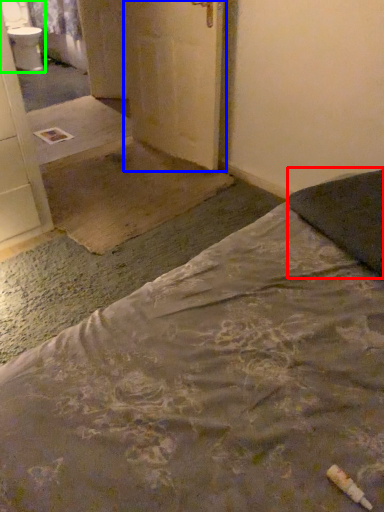
Question: Estimate the real-world distances between objects in this image. Which object is farther from pillow (highlighted by a red box), door (highlighted by a blue box) or sink (highlighted by a green box)?

Choices:
 (A) door
 (B) sink

Answer: (B)